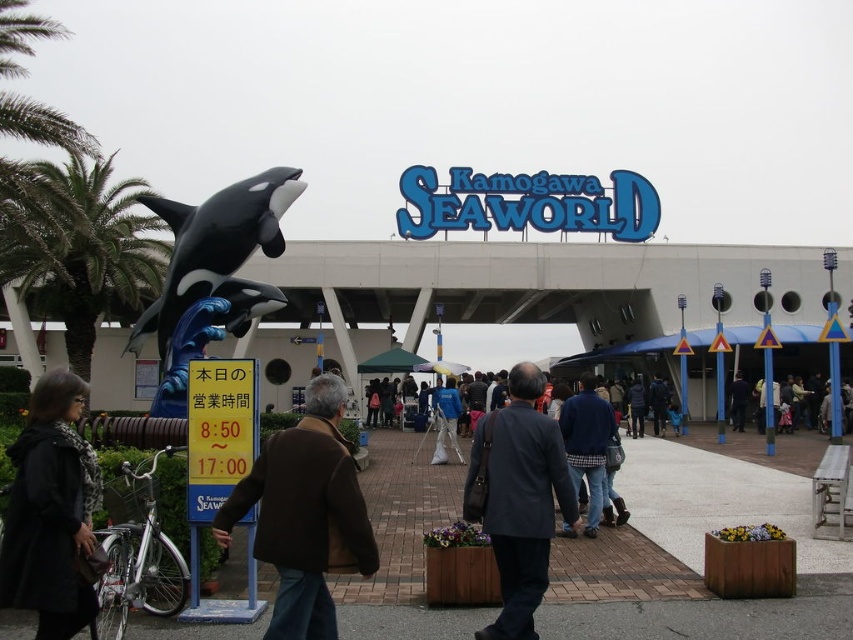
Question: Considering the real-world distances, which object is closest to the black matte coat at lower left?

Choices:
 (A) plaid fabric shirt at center
 (B) brown leather jacket at center

Answer: (B)

Question: Does black matte coat at lower left have a greater width compared to dark gray suit at center?

Choices:
 (A) yes
 (B) no

Answer: (B)

Question: Does brown leather jacket at center have a larger size compared to green leafy palm tree at left?

Choices:
 (A) no
 (B) yes

Answer: (A)

Question: Which object is the closest to the black glossy orca at left?

Choices:
 (A) dark gray suit at center
 (B) blue plaid shirt at center

Answer: (A)

Question: Is the position of green leafy palm tree at left less distant than that of plaid fabric shirt at center?

Choices:
 (A) yes
 (B) no

Answer: (A)

Question: Which point is farther from the camera taking this photo?

Choices:
 (A) (83, 518)
 (B) (849, 420)
 (C) (582, 378)
 (D) (270, 625)

Answer: (C)